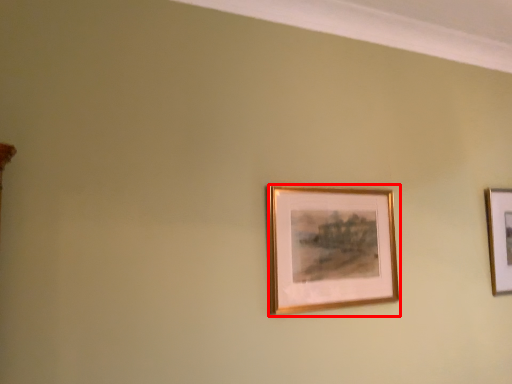
Question: Where is picture frame (annotated by the red box) located in relation to picture frame in the image?

Choices:
 (A) left
 (B) right

Answer: (A)